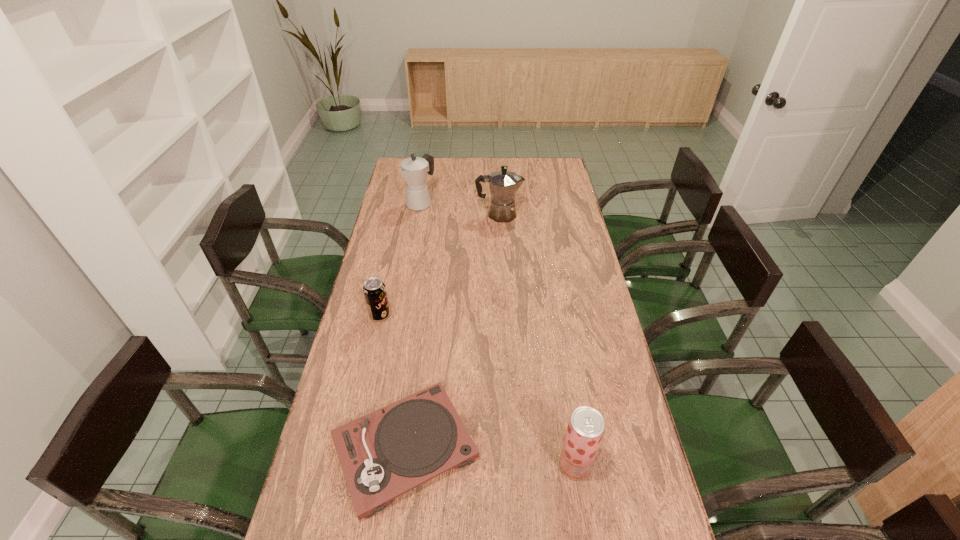
Locate an element on the screen. This screenshot has height=540, width=960. the left coffeepot is located at coordinates (414, 170).

Where is `the right coffeepot`? the right coffeepot is located at coordinates (503, 184).

The height and width of the screenshot is (540, 960). What are the coordinates of `the rightmost object` in the screenshot? It's located at (586, 426).

You are a GUI agent. You are given a task and a screenshot of the screen. Output one action in this format:
    pyautogui.click(x=<x>, y=<y>)
    Task: Click on the soda can
    The width and height of the screenshot is (960, 540).
    Given the screenshot: What is the action you would take?
    pyautogui.click(x=374, y=290)

Find the location of a particular element. This screenshot has height=540, width=960. the third farthest object is located at coordinates (374, 290).

You are a GUI agent. You are given a task and a screenshot of the screen. Output one action in this format:
    pyautogui.click(x=<x>, y=<y>)
    Task: Click on the shortest object
    
    Given the screenshot: What is the action you would take?
    pyautogui.click(x=384, y=454)

The width and height of the screenshot is (960, 540). What are the coordinates of `free space located on the right of the left coffeepot` in the screenshot? It's located at (475, 203).

The image size is (960, 540). I want to click on vacant space located 0.170m on the pouring side of the right coffeepot, so point(562,214).

Locate an element on the screen. The image size is (960, 540). free region located on the back of the fruit juice is located at coordinates (566, 415).

What are the coordinates of `vacant space located on the front of the soda can` in the screenshot? It's located at (375, 334).